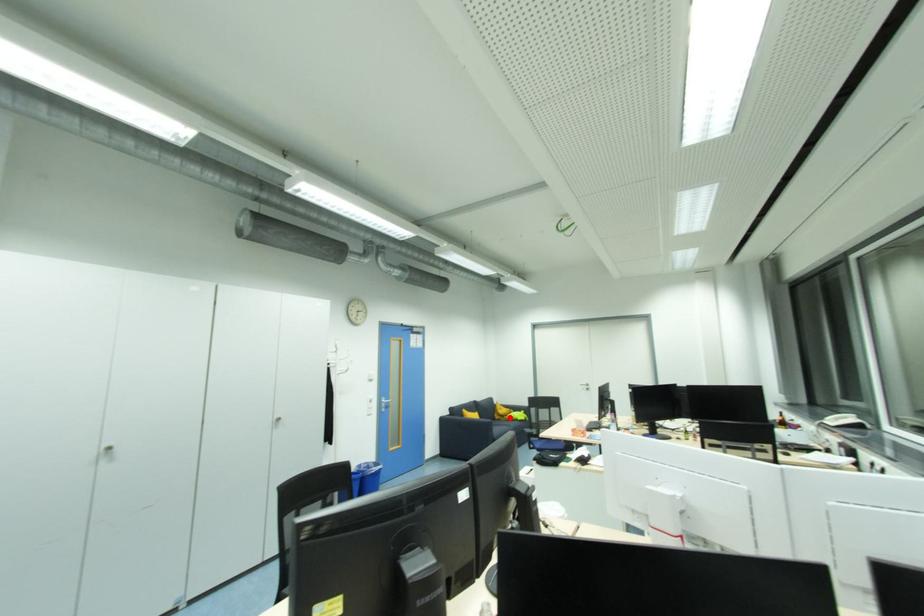
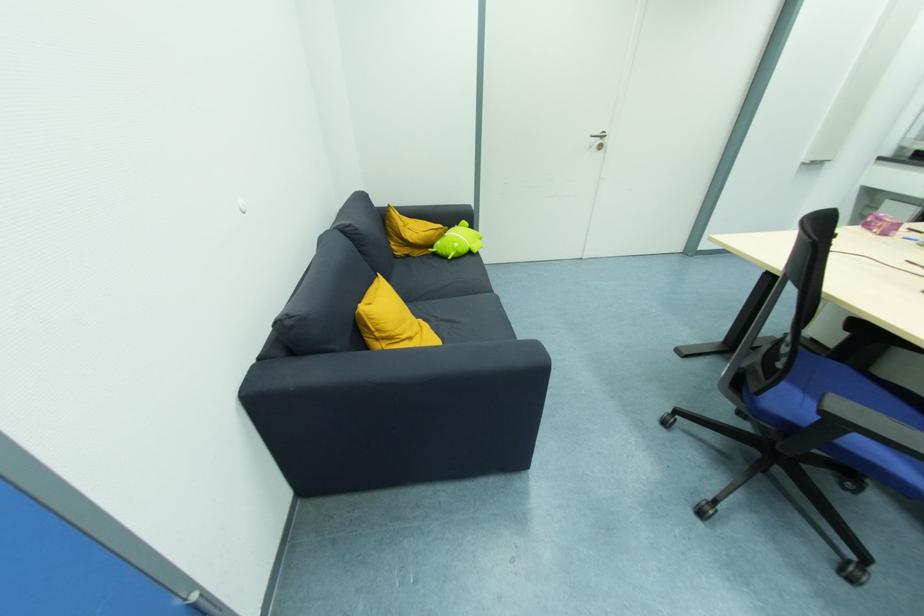
Where in the second image is the point corresponding to the highlighted location from the first image?

(435, 248)